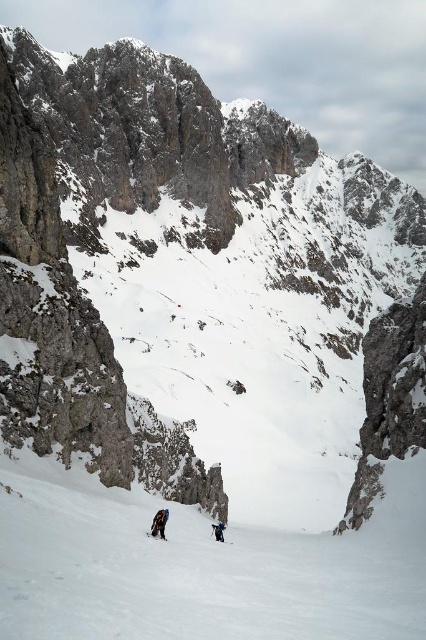
Does dark gray fabric jacket at center appear under blue fabric jacket at center?

No, dark gray fabric jacket at center is not below blue fabric jacket at center.

Can you confirm if dark gray fabric jacket at center is positioned to the right of blue fabric jacket at center?

Incorrect, dark gray fabric jacket at center is not on the right side of blue fabric jacket at center.

Which is in front, point (155, 516) or point (215, 532)?

Point (155, 516) is in front.

Locate an element on the screen. dark gray fabric jacket at center is located at coordinates (160, 522).

Is dark gray fabric jacket at center wider than matte black ski at lower center?

Yes, dark gray fabric jacket at center is wider than matte black ski at lower center.

Who is taller, dark gray fabric jacket at center or matte black ski at lower center?

dark gray fabric jacket at center is taller.

Is point (158, 529) farther from viewer compared to point (164, 538)?

No, (158, 529) is closer to viewer.

Image resolution: width=426 pixels, height=640 pixels. Find the location of `dark gray fabric jacket at center`. dark gray fabric jacket at center is located at coordinates (160, 522).

Does white snow ski slope at lower center appear on the left side of dark gray fabric jacket at center?

Incorrect, white snow ski slope at lower center is not on the left side of dark gray fabric jacket at center.

Based on the photo, does white snow ski slope at lower center have a greater height compared to dark gray fabric jacket at center?

Indeed, white snow ski slope at lower center has a greater height compared to dark gray fabric jacket at center.

Between point (235, 611) and point (161, 522), which one is positioned behind?

Point (161, 522)

What are the coordinates of `white snow ski slope at lower center` in the screenshot? It's located at (204, 570).